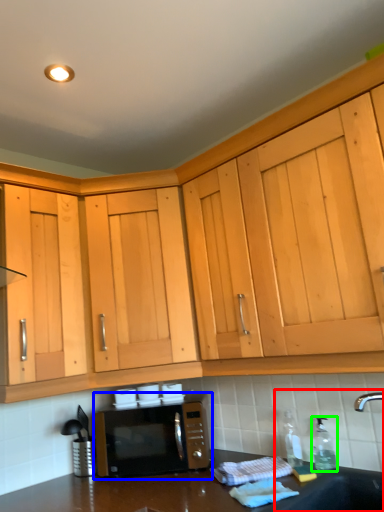
Question: Considering the real-world distances, which object is farthest from sink (highlighted by a red box)? microwave oven (highlighted by a blue box) or bottle (highlighted by a green box)?

Choices:
 (A) microwave oven
 (B) bottle

Answer: (A)